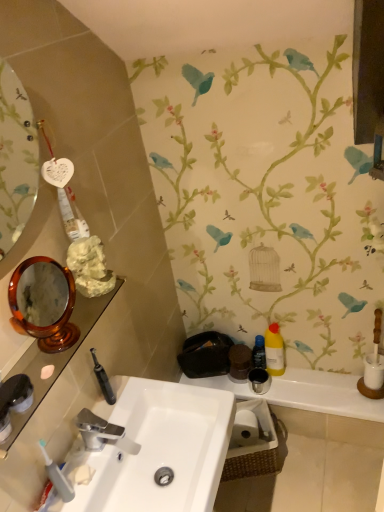
Locate an element on the screen. The image size is (384, 512). free spot above matte black tray at lower center (from a real-world perspective) is located at coordinates (304, 382).